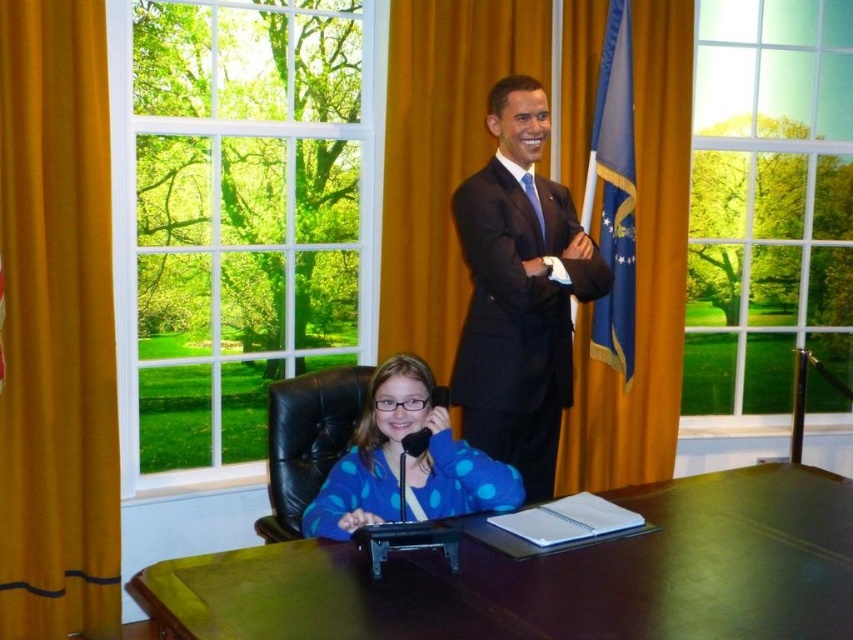
Question: Can you confirm if orange velvet curtain at center is smaller than blue polka dot sweater at center?

Choices:
 (A) yes
 (B) no

Answer: (B)

Question: Is dark brown polished wood table at center to the left of orange fabric curtain at left from the viewer's perspective?

Choices:
 (A) yes
 (B) no

Answer: (B)

Question: Which object appears farthest from the camera in this image?

Choices:
 (A) blue fabric flag at right
 (B) orange velvet curtain at center

Answer: (A)

Question: Which object is the closest to the orange fabric curtain at left?

Choices:
 (A) black suit at center
 (B) blue silk tie at upper center
 (C) blue polka dot sweater at center

Answer: (C)

Question: Can you confirm if black suit at center is smaller than blue silk tie at upper center?

Choices:
 (A) no
 (B) yes

Answer: (A)

Question: Which point appears farthest from the camera in this image?

Choices:
 (A) (543, 237)
 (B) (397, 112)

Answer: (B)